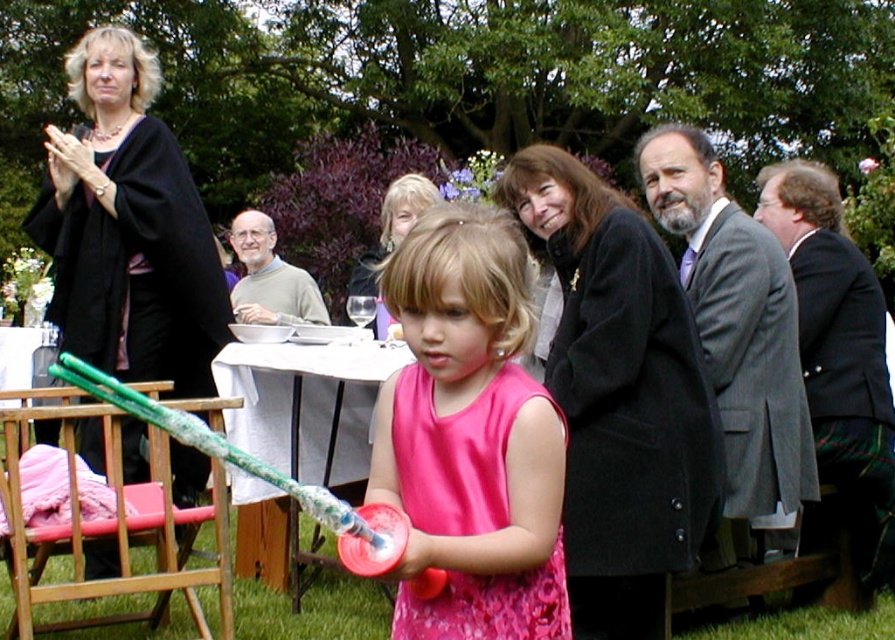
Who is positioned more to the right, pink satin dress at center or gray wool sweater at upper center?

Positioned to the right is pink satin dress at center.

Is point (446, 577) more distant than point (279, 292)?

No, (446, 577) is in front of (279, 292).

The height and width of the screenshot is (640, 895). Find the location of `pink satin dress at center`. pink satin dress at center is located at coordinates (470, 435).

Is point (726, 241) farther from camera compared to point (286, 288)?

No.

Which of these two, gray wool suit at upper right or gray wool sweater at upper center, stands shorter?

Standing shorter between the two is gray wool sweater at upper center.

Which is behind, point (743, 403) or point (258, 282)?

The point (258, 282) is behind.

Identify the location of gray wool suit at upper right. The width and height of the screenshot is (895, 640). (737, 326).

Does point (482, 259) come behind point (857, 323)?

No, (482, 259) is closer to viewer.

Who is taller, pink satin dress at center or green plaid kilt at right?

With more height is green plaid kilt at right.

Where is `pink satin dress at center`? The image size is (895, 640). pink satin dress at center is located at coordinates click(x=470, y=435).